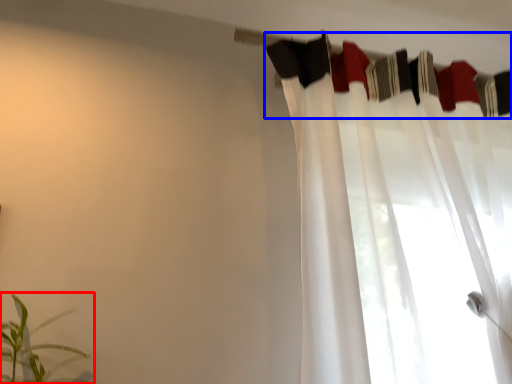
Question: Among these objects, which one is farthest to the camera, houseplant (highlighted by a red box) or clothesline (highlighted by a blue box)?

Choices:
 (A) houseplant
 (B) clothesline

Answer: (B)